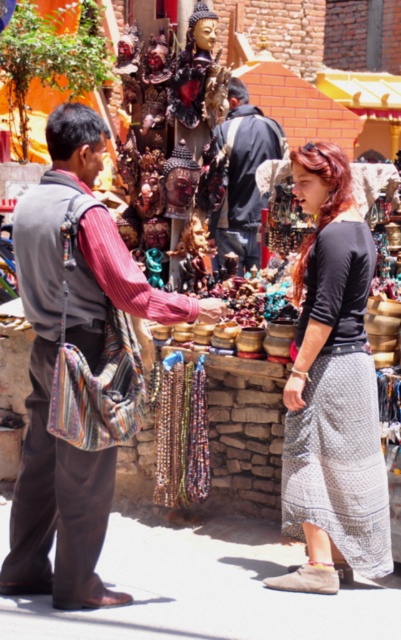
Based on the photo, you are standing at the camera position looking at the two points in the market scene. Which point, point (x=366, y=452) or point (x=178, y=483), is nearer to you?

Point (x=366, y=452) is closer to the camera than point (x=178, y=483), so it is nearer to you.

You are a vendor at the market and want to place a large basket between the dark blue fabric jacket at center and the multicolored beaded necklace at center. The basket requires 4 meters of space. Can you fit it between them?

The dark blue fabric jacket at center and multicolored beaded necklace at center are 3.80 meters apart. Since the required space for the basket is 4 meters, which is larger than the available distance, the basket cannot be placed between them.

You are a vendor at the market and need to retrieve the black cotton skirt at center from under the knitted fabric bag at left. Is the bag currently covering the skirt?

The knitted fabric bag at left is positioned over the black cotton skirt at center, so yes, the bag is currently covering the skirt.